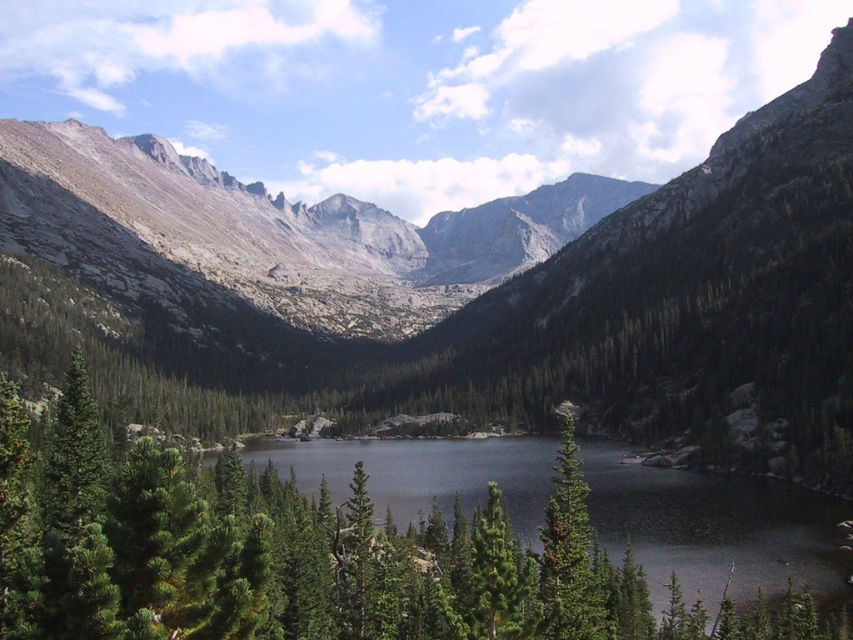
Which is behind, point (679, 509) or point (589, 540)?

The point (679, 509) is more distant.

Does smooth dark water at center have a smaller size compared to green matte tree at center?

Actually, smooth dark water at center might be larger than green matte tree at center.

Who is more forward, [596,529] or [555,584]?

Point [555,584] is more forward.

Find the location of a particular element. smooth dark water at center is located at coordinates (712, 525).

Where is `smooth gray rock at center`? The height and width of the screenshot is (640, 853). smooth gray rock at center is located at coordinates (494, 284).

What do you see at coordinates (494, 284) in the screenshot? Image resolution: width=853 pixels, height=640 pixels. I see `smooth gray rock at center` at bounding box center [494, 284].

In order to click on smooth gray rock at center in this screenshot , I will do `click(494, 284)`.

Is smooth gray rock at center in front of green matte tree at center?

No, it is not.

Is smooth gray rock at center behind green matte tree at center?

That is True.

Is point (729, 355) positioned before point (601, 580)?

No, (729, 355) is behind (601, 580).

This screenshot has height=640, width=853. I want to click on smooth gray rock at center, so click(x=494, y=284).